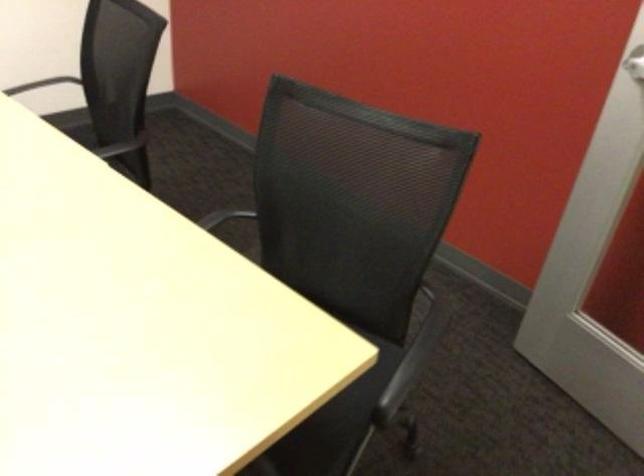
In order to click on silver door handle in this screenshot , I will do `click(634, 64)`.